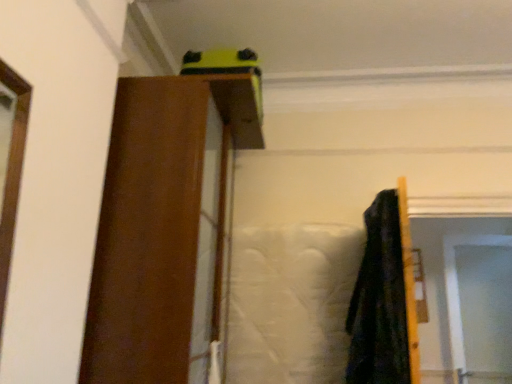
Question: Is brown wood barn door at upper center inside the boundaries of transparent plastic screen door at upper right, or outside?

Choices:
 (A) outside
 (B) inside

Answer: (A)

Question: From the image's perspective, is brown wood barn door at upper center above or below transparent plastic screen door at upper right?

Choices:
 (A) above
 (B) below

Answer: (A)

Question: Looking at their shapes, would you say brown wood barn door at upper center is wider or thinner than transparent plastic screen door at upper right?

Choices:
 (A) thin
 (B) wide

Answer: (B)

Question: Choose the correct answer: Is transparent plastic screen door at upper right inside brown wood barn door at upper center or outside it?

Choices:
 (A) inside
 (B) outside

Answer: (B)

Question: Considering the positions of transparent plastic screen door at upper right and brown wood barn door at upper center in the image, is transparent plastic screen door at upper right wider or thinner than brown wood barn door at upper center?

Choices:
 (A) wide
 (B) thin

Answer: (B)

Question: Is transparent plastic screen door at upper right bigger or smaller than brown wood barn door at upper center?

Choices:
 (A) small
 (B) big

Answer: (A)

Question: From the image's perspective, is transparent plastic screen door at upper right located above or below brown wood barn door at upper center?

Choices:
 (A) below
 (B) above

Answer: (A)